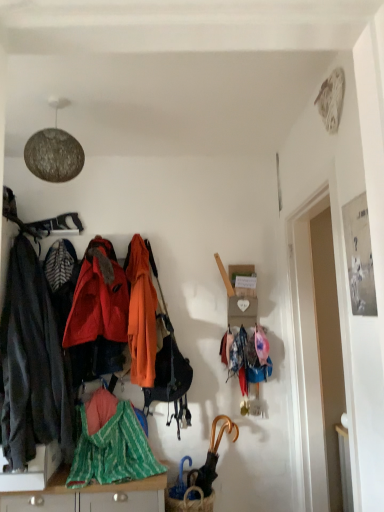
This screenshot has width=384, height=512. In order to click on green striped fabric at lower center in this screenshot , I will do `click(113, 451)`.

What is the approximate height of wooden cabinet at lower center?

The height of wooden cabinet at lower center is 11.02 inches.

The height and width of the screenshot is (512, 384). What are the coordinates of `dark gray fabric jacket at left, which is counted as the 1th jacket, starting from the left` in the screenshot? It's located at (32, 364).

The width and height of the screenshot is (384, 512). Describe the element at coordinates (141, 314) in the screenshot. I see `orange cotton jacket at center, which appears as the first jacket when viewed from the right` at that location.

I want to click on green striped fabric at lower center, so click(113, 451).

Can you confirm if fuzzy pink hat at center-right is smaller than green striped fabric at lower left?

Indeed, fuzzy pink hat at center-right has a smaller size compared to green striped fabric at lower left.

Is fuzzy pink hat at center-right thinner than green striped fabric at lower left?

Indeed, fuzzy pink hat at center-right has a lesser width compared to green striped fabric at lower left.

Is fuzzy pink hat at center-right in front of green striped fabric at lower left?

No, it is behind green striped fabric at lower left.

From a real-world perspective, which is physically above, fuzzy pink hat at center-right or green striped fabric at lower left?

fuzzy pink hat at center-right, from a real-world perspective.

Which object is positioned more to the right, orange matte handbag at center or wooden cabinet at lower center?

From the viewer's perspective, orange matte handbag at center appears more on the right side.

At what (x,y) coordinates should I click in order to perform the action: click on cabinetry below the orange matte handbag at center (from a real-world perspective). Please return your answer as a coordinate pair (x, y). Image resolution: width=384 pixels, height=512 pixels. Looking at the image, I should click on (90, 496).

Is point (166, 374) positioned in front of point (114, 494)?

No, (166, 374) is behind (114, 494).

Considering the sizes of objects orange matte handbag at center and wooden cabinet at lower center in the image provided, who is thinner, orange matte handbag at center or wooden cabinet at lower center?

Thinner between the two is orange matte handbag at center.

Is gold metallic umbrella at lower center far from green striped fabric at lower center?

No, there isn't a large distance between gold metallic umbrella at lower center and green striped fabric at lower center.

Which of these two, gold metallic umbrella at lower center or green striped fabric at lower center, is smaller?

With smaller size is gold metallic umbrella at lower center.

Is gold metallic umbrella at lower center inside or outside of green striped fabric at lower center?

gold metallic umbrella at lower center is located beyond the bounds of green striped fabric at lower center.

Measure the distance from gold metallic umbrella at lower center to green striped fabric at lower center.

gold metallic umbrella at lower center and green striped fabric at lower center are 17.20 inches apart.

Considering the positions of points (107, 291) and (144, 359), is point (107, 291) farther from camera compared to point (144, 359)?

Yes.

From the image's perspective, is shiny red jacket at center, arranged as the 2th jacket when viewed from the left, located above or below orange cotton jacket at center, which appears as the first jacket when viewed from the right?

shiny red jacket at center, arranged as the 2th jacket when viewed from the left, is situated higher than orange cotton jacket at center, which appears as the first jacket when viewed from the right, in the image.

Is shiny red jacket at center, arranged as the 2th jacket when viewed from the left, thinner than orange cotton jacket at center, placed as the 3th jacket when sorted from left to right?

Incorrect, the width of shiny red jacket at center, arranged as the 2th jacket when viewed from the left, is not less than that of orange cotton jacket at center, placed as the 3th jacket when sorted from left to right.

Can you confirm if shiny red jacket at center, which is the second jacket from right to left, is shorter than orange cotton jacket at center, which appears as the first jacket when viewed from the right?

Indeed, shiny red jacket at center, which is the second jacket from right to left, has a lesser height compared to orange cotton jacket at center, which appears as the first jacket when viewed from the right.

Is gold metallic umbrella at lower center at the right side of shiny red jacket at center, which is the second jacket from right to left?

Yes, gold metallic umbrella at lower center is to the right of shiny red jacket at center, which is the second jacket from right to left.

Could you tell me if gold metallic umbrella at lower center is facing shiny red jacket at center, which is the second jacket from right to left?

No.

Which object is thinner, gold metallic umbrella at lower center or shiny red jacket at center, which is the second jacket from right to left?

gold metallic umbrella at lower center is thinner.

Does gold metallic umbrella at lower center have a larger size compared to shiny red jacket at center, arranged as the 2th jacket when viewed from the left?

No.

Is green striped fabric at lower left not within wooden cabinet at lower center?

green striped fabric at lower left is positioned outside wooden cabinet at lower center.

Would you say green striped fabric at lower left is a long distance from wooden cabinet at lower center?

green striped fabric at lower left is near wooden cabinet at lower center, not far away.

Who is taller, green striped fabric at lower left or wooden cabinet at lower center?

Standing taller between the two is wooden cabinet at lower center.

Looking at this image, is orange cotton jacket at center, which appears as the first jacket when viewed from the right, oriented away from shiny red jacket at center, which is the second jacket from right to left?

No.

Does point (145, 282) come farther from viewer compared to point (112, 301)?

Yes, point (145, 282) is farther from viewer.

Do you think orange cotton jacket at center, placed as the 3th jacket when sorted from left to right, is within shiny red jacket at center, which is the second jacket from right to left, or outside of it?

orange cotton jacket at center, placed as the 3th jacket when sorted from left to right, is not enclosed by shiny red jacket at center, which is the second jacket from right to left.

Does orange cotton jacket at center, placed as the 3th jacket when sorted from left to right, touch shiny red jacket at center, which is the second jacket from right to left?

orange cotton jacket at center, placed as the 3th jacket when sorted from left to right, and shiny red jacket at center, which is the second jacket from right to left, are clearly separated.

The image size is (384, 512). Identify the location of hat positioned vertically above the green striped fabric at lower left (from a real-world perspective). coord(261,345).

Find the location of a particular element. This screenshot has height=512, width=384. handbag that appears above the wooden cabinet at lower center (from the image's perspective) is located at coordinates (169, 368).

Considering their positions, is fuzzy pink hat at center-right positioned further to shiny red jacket at center, which is the second jacket from right to left, than green striped fabric at lower left?

fuzzy pink hat at center-right lies further to shiny red jacket at center, which is the second jacket from right to left, than the other object.

Based on their spatial positions, is wooden cabinet at lower center or orange matte handbag at center further from green striped fabric at lower left?

orange matte handbag at center.

Estimate the real-world distances between objects in this image. Which object is closer to wooden cabinet at lower center, dark gray fabric jacket at left, the third jacket positioned from the right, or gold metallic umbrella at lower center?

gold metallic umbrella at lower center.

Estimate the real-world distances between objects in this image. Which object is further from gold metallic umbrella at lower center, green striped fabric at lower center or orange matte handbag at center?

Based on the image, green striped fabric at lower center appears to be further to gold metallic umbrella at lower center.

Which object lies further to the anchor point gold metallic umbrella at lower center, shiny red jacket at center, which is the second jacket from right to left, or green striped fabric at lower left?

The object further to gold metallic umbrella at lower center is shiny red jacket at center, which is the second jacket from right to left.

Based on their spatial positions, is orange cotton jacket at center, placed as the 3th jacket when sorted from left to right, or fuzzy pink hat at center-right closer to wooden cabinet at lower center?

Based on the image, orange cotton jacket at center, placed as the 3th jacket when sorted from left to right, appears to be nearer to wooden cabinet at lower center.

Estimate the real-world distances between objects in this image. Which object is further from fuzzy pink hat at center-right, orange cotton jacket at center, which appears as the first jacket when viewed from the right, or orange matte handbag at center?

orange cotton jacket at center, which appears as the first jacket when viewed from the right, is further to fuzzy pink hat at center-right.

Considering their positions, is green striped fabric at lower center positioned further to shiny red jacket at center, arranged as the 2th jacket when viewed from the left, than dark gray fabric jacket at left, which is counted as the 1th jacket, starting from the left?

green striped fabric at lower center is positioned further to the anchor shiny red jacket at center, arranged as the 2th jacket when viewed from the left.

Locate an element on the screen. The width and height of the screenshot is (384, 512). umbrella between orange matte handbag at center and wooden cabinet at lower center in the up-down direction is located at coordinates (211, 457).

Image resolution: width=384 pixels, height=512 pixels. Find the location of `blanket between shiny red jacket at center, arranged as the 2th jacket when viewed from the left, and wooden cabinet at lower center vertically`. blanket between shiny red jacket at center, arranged as the 2th jacket when viewed from the left, and wooden cabinet at lower center vertically is located at coordinates (113, 451).

Find the location of a particular element. The width and height of the screenshot is (384, 512). handbag between shiny red jacket at center, arranged as the 2th jacket when viewed from the left, and fuzzy pink hat at center-right from left to right is located at coordinates (169, 368).

The height and width of the screenshot is (512, 384). I want to click on handbag that lies between orange cotton jacket at center, which appears as the first jacket when viewed from the right, and green striped fabric at lower left from top to bottom, so [x=169, y=368].